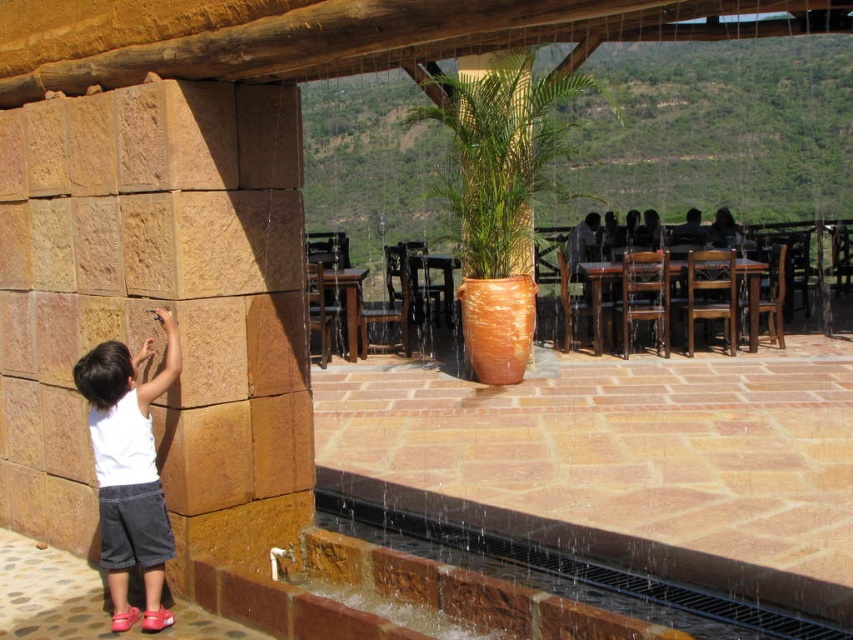
You are a photographer setting up a shot of the brown stone wall at left and the white cotton shirt at left. Since you want to ensure both are fully visible in the frame, which object should you focus on first to adjust your camera angle?

The brown stone wall at left is taller than the white cotton shirt at left, so you should focus on adjusting your camera angle to accommodate the height of the brown stone wall at left first to ensure both are fully visible.